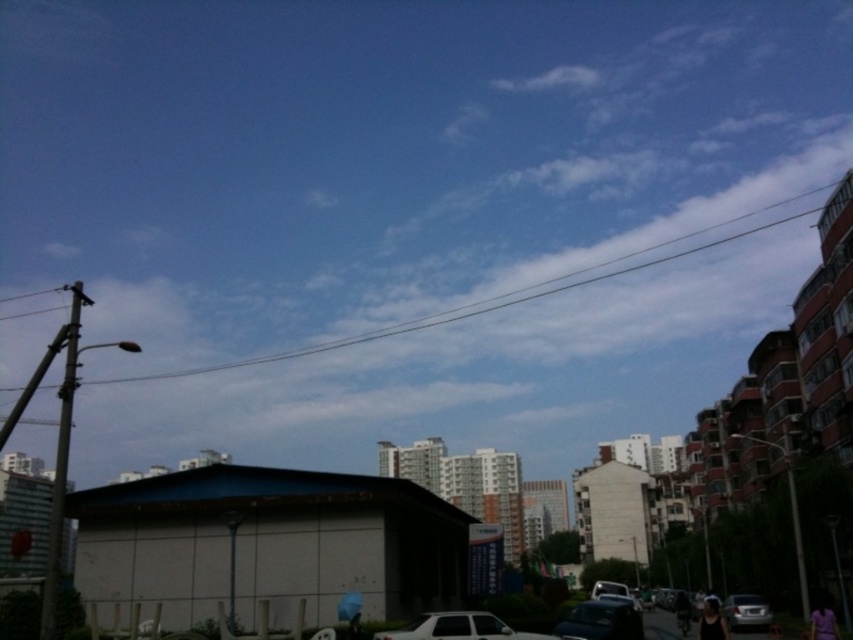
You are a delivery driver who needs to park your vehicle. You see a shiny black car at center and a satin silver sedan at lower right. Which vehicle has more space for you to maneuver around it?

The satin silver sedan at lower right is longer than the shiny black car at center, so there might be more space around it for maneuvering.

Please provide the coordinates of the white matte car at lower center in the image. The coordinate system uses the bottom left corner as the origin point. The x and y values range from 0 to 1. Please format your answer as follows, using the exact object label from the input and the coordinates from the Objects Description. Answer with the exact coordinates provided in the Objects Description. Do not add any extra information. Answer with only the coordinates in the format of x,y. For example, if the car is

(457, 627)